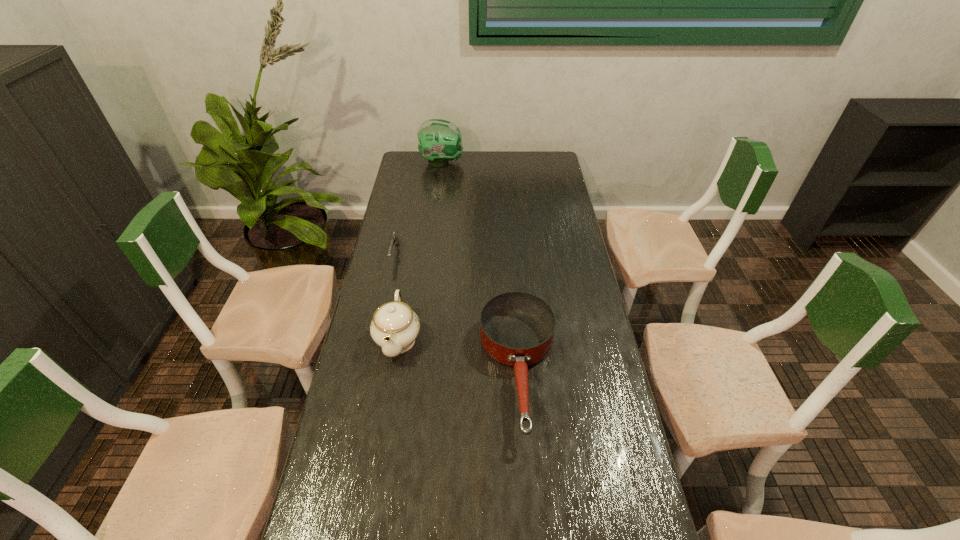
Find the location of a particular element. empty space between the farthest object and the rightmost object is located at coordinates (480, 267).

Image resolution: width=960 pixels, height=540 pixels. In order to click on free space that is in between the shortest object and the football helmet in this screenshot , I will do [419, 208].

This screenshot has height=540, width=960. In order to click on blank region between the pan and the tallest object in this screenshot , I will do `click(480, 267)`.

Locate an element on the screen. The image size is (960, 540). free area in between the third nearest object and the football helmet is located at coordinates (419, 208).

Where is `vacant area that lies between the tallest object and the second farthest object`? The image size is (960, 540). vacant area that lies between the tallest object and the second farthest object is located at coordinates (419, 208).

Find the location of a particular element. The image size is (960, 540). free space between the gun and the farthest object is located at coordinates (419, 208).

Find the location of a particular element. vacant region between the chinaware and the pan is located at coordinates (458, 355).

This screenshot has height=540, width=960. I want to click on free space between the third tallest object and the farthest object, so click(480, 267).

I want to click on free space that is in between the football helmet and the pan, so click(480, 267).

The width and height of the screenshot is (960, 540). In order to click on object identified as the second closest to the shortest object in this screenshot , I will do `click(517, 329)`.